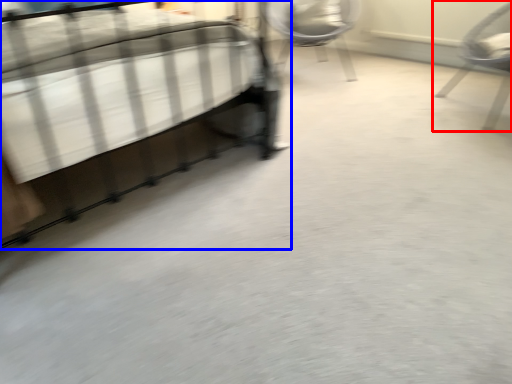
Question: Which object appears closest to the camera in this image, chair (highlighted by a red box) or bed (highlighted by a blue box)?

Choices:
 (A) chair
 (B) bed

Answer: (B)